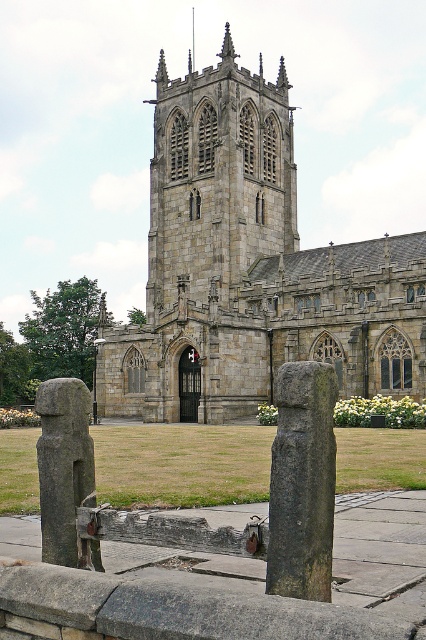
You are standing at the entrance of the stone gothic church at center. If you walk straight ahead, will you eventually face the stone fence with two large weathered posts and a horizontal beam connecting them?

The stone gothic church at center is positioned at point (250, 268), so walking straight ahead from the entrance would lead you towards the stone fence with two large weathered posts and a horizontal beam connecting them.

You are a tourist standing in front of the stone gothic church at center and dark gray stone pillar at center. You want to take a photo that includes both objects but emphasizes the church. Which object should you position closer to the camera to achieve this?

To emphasize the stone gothic church at center in the photo, position the dark gray stone pillar at center closer to the camera since the stone gothic church at center is larger and will appear more prominent when the pillar is nearer, creating a depth effect.